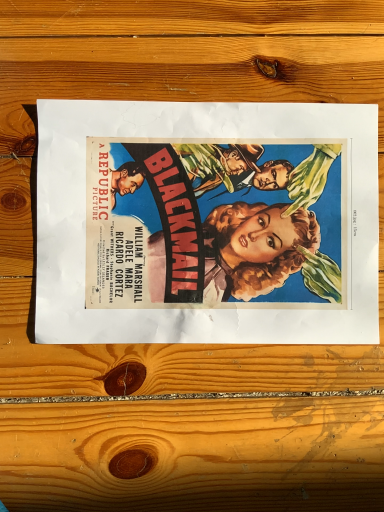
This screenshot has width=384, height=512. I want to click on free space above matte paper poster at center (from a real-world perspective), so click(x=208, y=220).